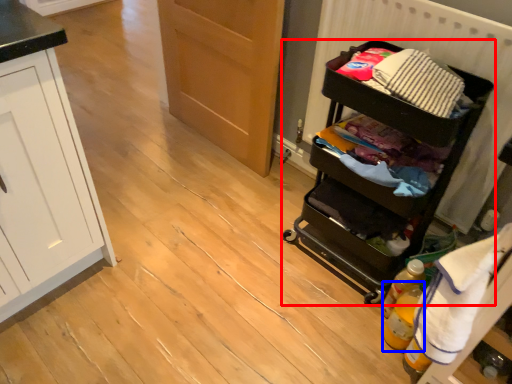
Question: Which object is further to the camera taking this photo, furniture (highlighted by a red box) or bottle (highlighted by a blue box)?

Choices:
 (A) furniture
 (B) bottle

Answer: (B)